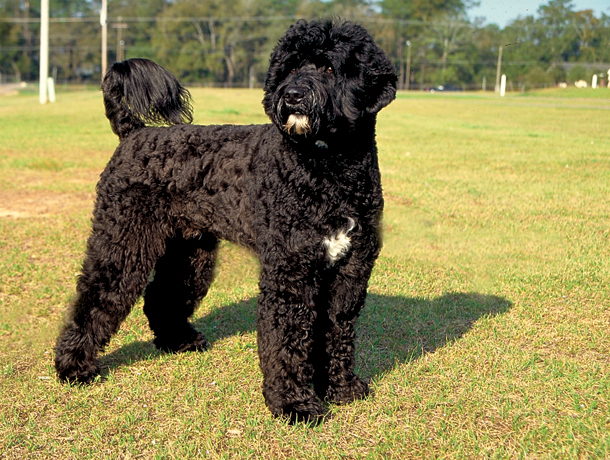
Find the location of `the right front leg`. the right front leg is located at coordinates (291, 335).